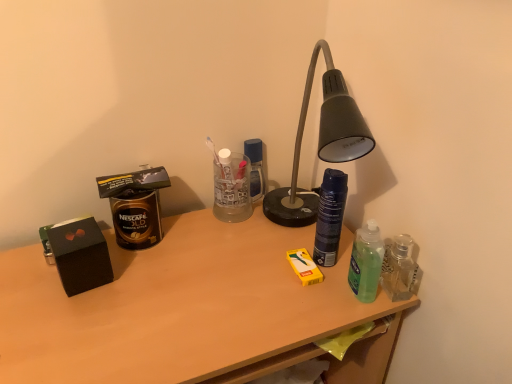
At what (x,y) coordinates should I click in order to perform the action: click on vacant area that is in front of dark blue matte spray can at center, positioned as the 1th bottle in left-to-right order. Please return your answer as a coordinate pair (x, y). This screenshot has width=512, height=384. Looking at the image, I should click on (308, 307).